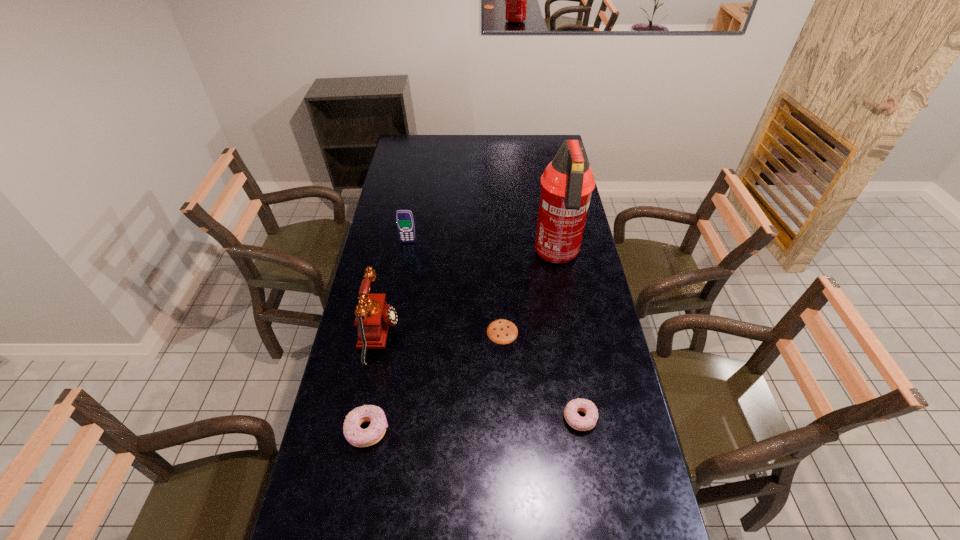
Identify the location of free space between the right doughnut and the taller doughnut. (473, 424).

Identify the location of free space between the telephone and the fourth tallest object. The width and height of the screenshot is (960, 540). (373, 383).

Where is `free area in between the left doughnut and the fourth shortest object`? Image resolution: width=960 pixels, height=540 pixels. free area in between the left doughnut and the fourth shortest object is located at coordinates (388, 336).

Find the location of a particular element. The image size is (960, 540). the fourth closest object to the tallest object is located at coordinates (586, 423).

Choose which object is the fourth nearest neighbor to the third tallest object. Please provide its 2D coordinates. Your answer should be formatted as a tuple, i.e. [(x, y)], where the tuple contains the x and y coordinates of a point satisfying the conditions above.

[(354, 434)]

Where is `vacant space that satisfies the following two spatial constraints: 1. on the front-facing side of the cellular telephone; 2. on the dial of the fifth shortest object`? The width and height of the screenshot is (960, 540). vacant space that satisfies the following two spatial constraints: 1. on the front-facing side of the cellular telephone; 2. on the dial of the fifth shortest object is located at coordinates (392, 335).

Find the location of a particular element. vacant position in the image that satisfies the following two spatial constraints: 1. on the front side of the right doughnut; 2. on the right side of the cookie is located at coordinates (506, 418).

At what (x,y) coordinates should I click in order to perform the action: click on vacant region that satisfies the following two spatial constraints: 1. on the dial of the second tallest object; 2. on the left side of the right doughnut. Please return your answer as a coordinate pair (x, y). The width and height of the screenshot is (960, 540). Looking at the image, I should click on (363, 418).

Where is `blank area in the image that satisfies the following two spatial constraints: 1. on the dial of the telephone; 2. on the back side of the second shortest object`? blank area in the image that satisfies the following two spatial constraints: 1. on the dial of the telephone; 2. on the back side of the second shortest object is located at coordinates (363, 418).

I want to click on vacant region that satisfies the following two spatial constraints: 1. on the dial of the second shortest object; 2. on the left side of the telephone, so click(363, 418).